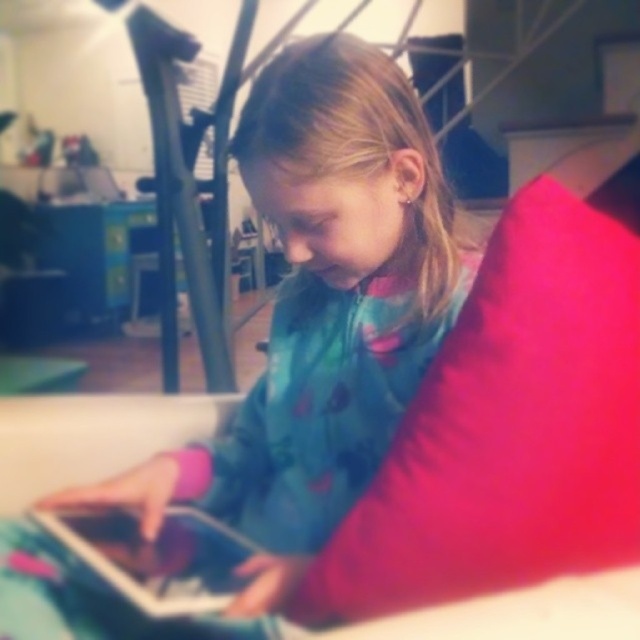
Question: Which point appears farthest from the camera in this image?

Choices:
 (A) (221, 593)
 (B) (557, 381)
 (C) (419, 230)

Answer: (C)

Question: Can you confirm if teal fabric jacket at center is positioned to the left of silver metallic tablet at lower left?

Choices:
 (A) no
 (B) yes

Answer: (A)

Question: Does teal fabric jacket at center appear under silver metallic tablet at lower left?

Choices:
 (A) yes
 (B) no

Answer: (B)

Question: Among these objects, which one is farthest from the camera?

Choices:
 (A) teal fabric jacket at center
 (B) silver metallic tablet at lower left
 (C) matte pink pillow at center-right

Answer: (A)

Question: Does teal fabric jacket at center have a smaller size compared to silver metallic tablet at lower left?

Choices:
 (A) yes
 (B) no

Answer: (B)

Question: Estimate the real-world distances between objects in this image. Which object is closer to the silver metallic tablet at lower left?

Choices:
 (A) teal fabric jacket at center
 (B) matte pink pillow at center-right

Answer: (A)